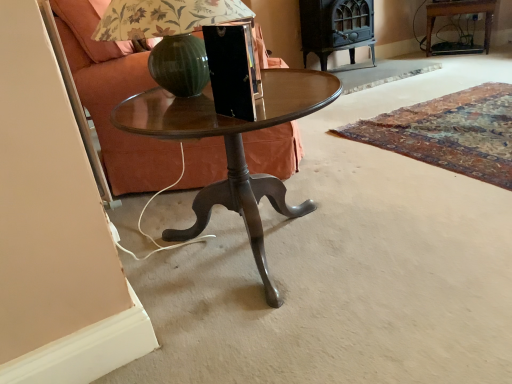
Question: From the image's perspective, is wooden side table at upper right below wooden glossy table at center?

Choices:
 (A) yes
 (B) no

Answer: (B)

Question: Is wooden side table at upper right wider than wooden glossy table at center?

Choices:
 (A) yes
 (B) no

Answer: (B)

Question: Can you confirm if wooden side table at upper right is thinner than wooden glossy table at center?

Choices:
 (A) yes
 (B) no

Answer: (A)

Question: Is wooden glossy table at center surrounded by wooden side table at upper right?

Choices:
 (A) no
 (B) yes

Answer: (A)

Question: Does wooden side table at upper right have a larger size compared to wooden glossy table at center?

Choices:
 (A) no
 (B) yes

Answer: (A)

Question: Considering the positions of wooden side table at upper right and wooden glossy table at center in the image, is wooden side table at upper right wider or thinner than wooden glossy table at center?

Choices:
 (A) wide
 (B) thin

Answer: (B)

Question: Looking at the image, does wooden side table at upper right seem bigger or smaller compared to wooden glossy table at center?

Choices:
 (A) big
 (B) small

Answer: (B)

Question: Is wooden side table at upper right inside or outside of wooden glossy table at center?

Choices:
 (A) outside
 (B) inside

Answer: (A)

Question: Visually, is wooden side table at upper right positioned to the left or to the right of wooden glossy table at center?

Choices:
 (A) right
 (B) left

Answer: (A)

Question: Relative to metallic green glass at center, is wooden side table at upper right in front or behind?

Choices:
 (A) behind
 (B) front

Answer: (A)

Question: From the image's perspective, is wooden side table at upper right above or below metallic green glass at center?

Choices:
 (A) above
 (B) below

Answer: (A)

Question: In terms of height, does wooden side table at upper right look taller or shorter compared to metallic green glass at center?

Choices:
 (A) short
 (B) tall

Answer: (B)

Question: Considering the positions of wooden side table at upper right and metallic green glass at center in the image, is wooden side table at upper right bigger or smaller than metallic green glass at center?

Choices:
 (A) small
 (B) big

Answer: (B)

Question: From a real-world perspective, is metallic green glass at center above or below matte brown fabric armchair at left?

Choices:
 (A) below
 (B) above

Answer: (B)

Question: Looking at their shapes, would you say metallic green glass at center is wider or thinner than matte brown fabric armchair at left?

Choices:
 (A) wide
 (B) thin

Answer: (B)